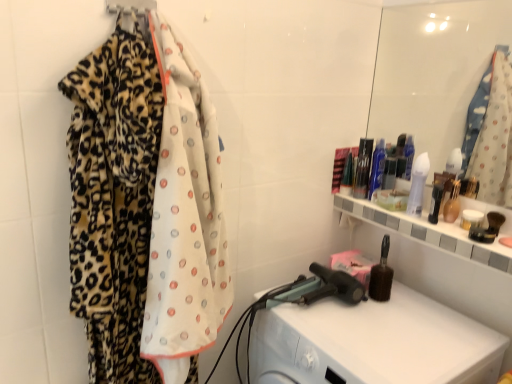
Question: Is leopard print fabric at upper left outside of green matte brush at upper right, the eighth toiletry when ordered from right to left?

Choices:
 (A) yes
 (B) no

Answer: (A)

Question: Considering the relative sizes of leopard print fabric at upper left and green matte brush at upper right, arranged as the first toiletry when viewed from the left, in the image provided, is leopard print fabric at upper left smaller than green matte brush at upper right, arranged as the first toiletry when viewed from the left,?

Choices:
 (A) yes
 (B) no

Answer: (A)

Question: Is the depth of leopard print fabric at upper left less than that of green matte brush at upper right, the eighth toiletry when ordered from right to left?

Choices:
 (A) yes
 (B) no

Answer: (A)

Question: From a real-world perspective, is leopard print fabric at upper left positioned under green matte brush at upper right, the eighth toiletry when ordered from right to left, based on gravity?

Choices:
 (A) yes
 (B) no

Answer: (B)

Question: Does leopard print fabric at upper left have a lesser height compared to green matte brush at upper right, arranged as the first toiletry when viewed from the left?

Choices:
 (A) no
 (B) yes

Answer: (B)

Question: From the image's perspective, would you say leopard print fabric at upper left is positioned over green matte brush at upper right, arranged as the first toiletry when viewed from the left?

Choices:
 (A) yes
 (B) no

Answer: (A)

Question: Can you see translucent glass vase at upper right, the 2th toiletry when ordered from right to left, touching translucent plastic bottle at right, arranged as the 3th toiletry when viewed from the right?

Choices:
 (A) yes
 (B) no

Answer: (A)

Question: From the image's perspective, does translucent glass vase at upper right, placed as the seventh toiletry when sorted from left to right, appear higher than translucent plastic bottle at right, which is the sixth toiletry in left-to-right order?

Choices:
 (A) no
 (B) yes

Answer: (A)

Question: Considering the relative sizes of translucent glass vase at upper right, the 2th toiletry when ordered from right to left, and translucent plastic bottle at right, which is the sixth toiletry in left-to-right order, in the image provided, is translucent glass vase at upper right, the 2th toiletry when ordered from right to left, bigger than translucent plastic bottle at right, which is the sixth toiletry in left-to-right order,?

Choices:
 (A) yes
 (B) no

Answer: (A)

Question: Is translucent glass vase at upper right, placed as the seventh toiletry when sorted from left to right, taller than translucent plastic bottle at right, arranged as the 3th toiletry when viewed from the right?

Choices:
 (A) no
 (B) yes

Answer: (A)

Question: Does translucent glass vase at upper right, the 2th toiletry when ordered from right to left, have a lesser width compared to translucent plastic bottle at right, arranged as the 3th toiletry when viewed from the right?

Choices:
 (A) no
 (B) yes

Answer: (A)

Question: Is the depth of translucent glass vase at upper right, the 2th toiletry when ordered from right to left, greater than that of translucent plastic bottle at right, which is the sixth toiletry in left-to-right order?

Choices:
 (A) no
 (B) yes

Answer: (A)

Question: Does white glossy lotion at upper right, the 5th toiletry from the left, lie behind leopard print fabric at upper left?

Choices:
 (A) yes
 (B) no

Answer: (A)